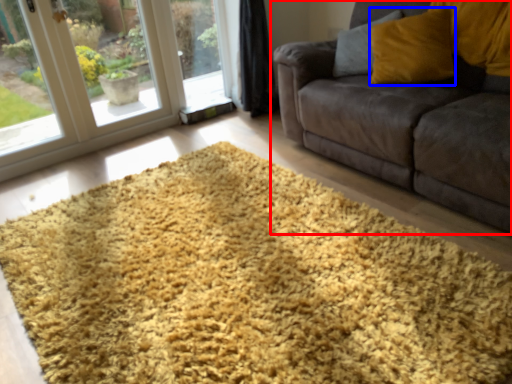
Question: Which of the following is the farthest to the observer, studio couch (highlighted by a red box) or throw pillow (highlighted by a blue box)?

Choices:
 (A) studio couch
 (B) throw pillow

Answer: (B)